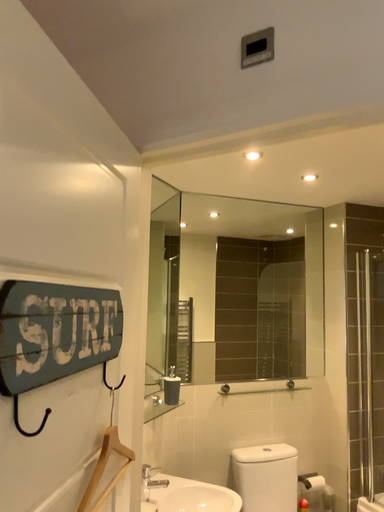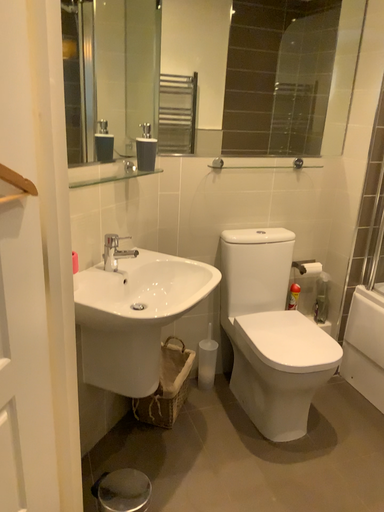
Question: Which way did the camera rotate in the video?

Choices:
 (A) rotated downward
 (B) rotated upward

Answer: (A)